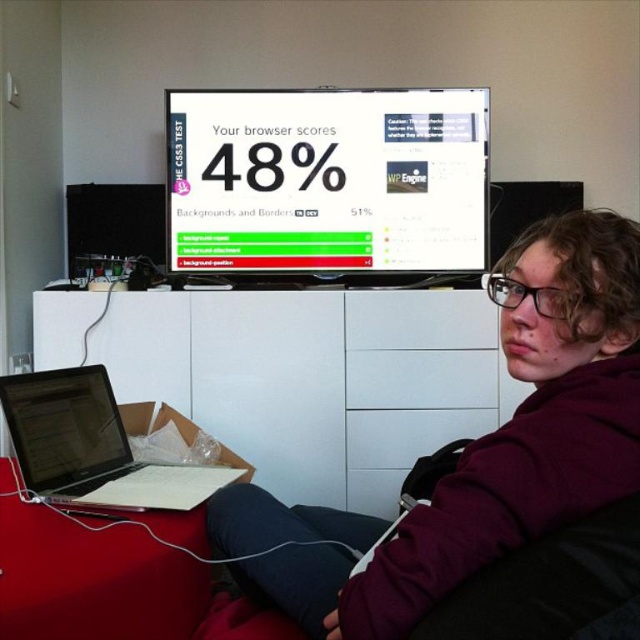
Question: From the image, what is the correct spatial relationship of white glossy computer screen at upper center in relation to matte black laptop at lower left?

Choices:
 (A) below
 (B) above

Answer: (B)

Question: Considering the real-world distances, which object is farthest from the matte black laptop at lower left?

Choices:
 (A) silver metallic laptop at lower left
 (B) white glossy computer screen at upper center
 (C) maroon hoodie at upper right

Answer: (B)

Question: Which point is closer to the camera?

Choices:
 (A) maroon hoodie at upper right
 (B) silver metallic laptop at lower left
 (C) matte black laptop at lower left

Answer: (A)

Question: Which point is closer to the camera?

Choices:
 (A) (211, 140)
 (B) (540, 468)

Answer: (B)

Question: Does white glossy computer screen at upper center appear on the right side of silver metallic laptop at lower left?

Choices:
 (A) no
 (B) yes

Answer: (B)

Question: Is maroon hoodie at upper right positioned at the back of silver metallic laptop at lower left?

Choices:
 (A) no
 (B) yes

Answer: (A)